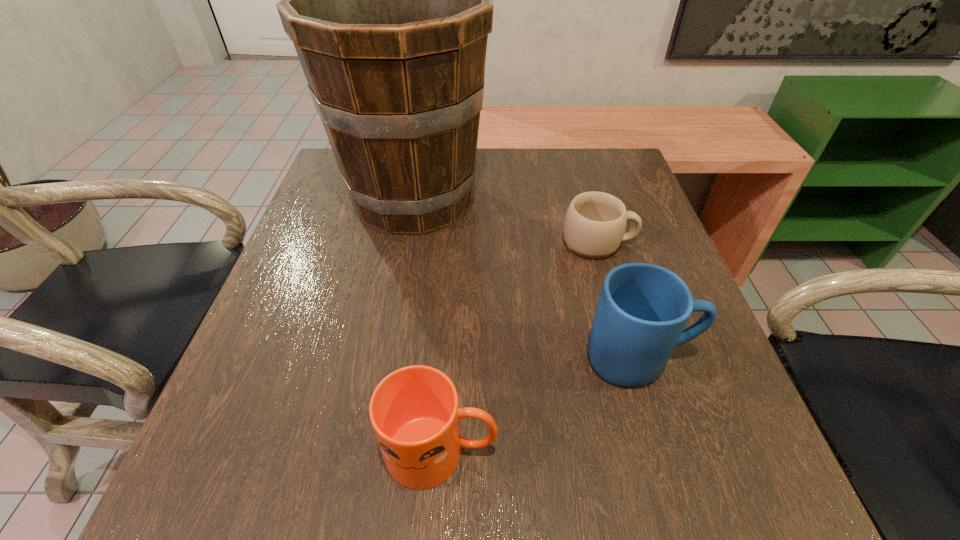
This screenshot has width=960, height=540. Find the location of `unoccupied area between the bucket and the shortest object`. unoccupied area between the bucket and the shortest object is located at coordinates (506, 221).

Locate an element on the screen. empty space that is in between the farthest mug and the second shortest object is located at coordinates (519, 347).

Locate an element on the screen. Image resolution: width=960 pixels, height=540 pixels. free space between the third shortest object and the bucket is located at coordinates (526, 279).

You are a GUI agent. You are given a task and a screenshot of the screen. Output one action in this format:
    pyautogui.click(x=<x>, y=<y>)
    Task: Click on the vacant region between the tallest object and the farthest mug
    
    Given the screenshot: What is the action you would take?
    pyautogui.click(x=506, y=221)

Image resolution: width=960 pixels, height=540 pixels. I want to click on vacant region between the second shortest object and the tallest mug, so click(540, 405).

You are a GUI agent. You are given a task and a screenshot of the screen. Output one action in this format:
    pyautogui.click(x=<x>, y=<y>)
    Task: Click on the vacant point located between the shortest object and the leftmost mug
    This screenshot has height=540, width=960.
    Given the screenshot: What is the action you would take?
    pyautogui.click(x=519, y=347)

Identify the location of vacant point located between the nearest object and the tallest object. (427, 325).

In order to click on the closest object to the second farthest mug in this screenshot , I will do `click(414, 411)`.

Where is `object that is the second closest to the second nearest mug`? object that is the second closest to the second nearest mug is located at coordinates (595, 222).

The height and width of the screenshot is (540, 960). In order to click on the closest mug to the shortest object in this screenshot , I will do `click(642, 311)`.